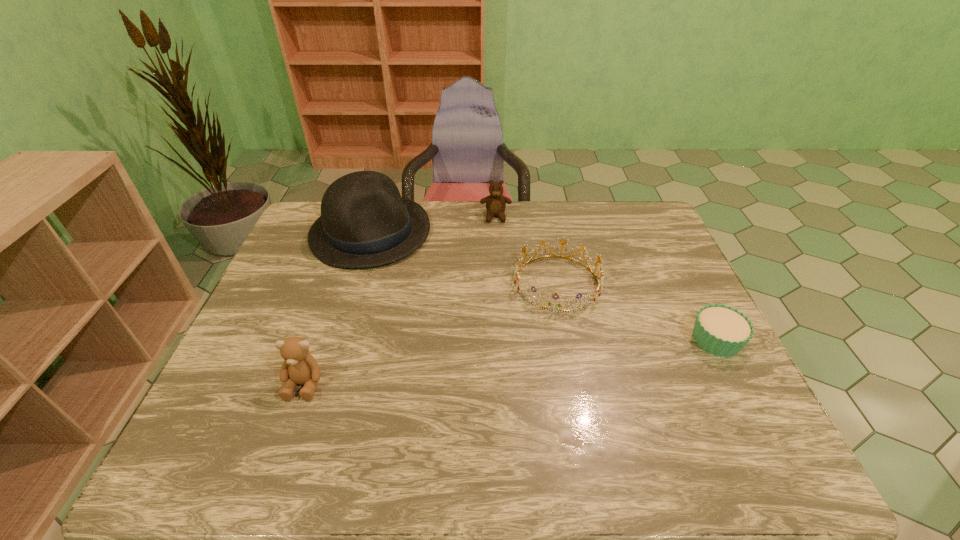
The image size is (960, 540). In order to click on free space on the desktop that is between the left teddy bear and the rightmost object and is positioned at the face of the farther teddy bear in this screenshot , I will do `click(499, 363)`.

Locate an element on the screen. free space on the desktop that is between the left teddy bear and the second nearest object and is positioned on the front-facing side of the tallest object is located at coordinates (475, 366).

You are a GUI agent. You are given a task and a screenshot of the screen. Output one action in this format:
    pyautogui.click(x=<x>, y=<y>)
    Task: Click on the vacant space on the desktop that is between the nearer teddy bear and the shortest object and is positioned on the front-facing side of the tiara
    
    Given the screenshot: What is the action you would take?
    pyautogui.click(x=547, y=358)